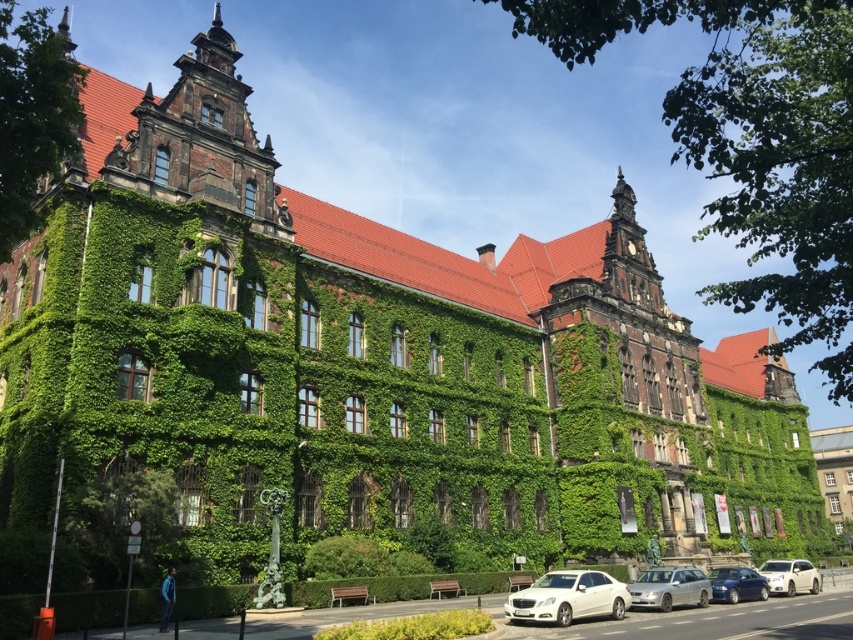
Question: Is silver metallic car at lower center above white matte car at lower right?

Choices:
 (A) no
 (B) yes

Answer: (B)

Question: Considering the real-world distances, which object is closest to the white glossy sedan at center?

Choices:
 (A) white matte car at lower right
 (B) metallic blue sedan at lower right
 (C) silver metallic car at lower center

Answer: (C)

Question: Can you confirm if silver metallic car at lower center is positioned above metallic blue sedan at lower right?

Choices:
 (A) yes
 (B) no

Answer: (B)

Question: Which of the following is the farthest from the observer?

Choices:
 (A) (664, 586)
 (B) (561, 600)
 (C) (790, 570)

Answer: (C)

Question: In this image, where is metallic blue sedan at lower right located relative to white matte car at lower right?

Choices:
 (A) left
 (B) right

Answer: (A)

Question: Based on their relative distances, which object is nearer to the metallic blue sedan at lower right?

Choices:
 (A) silver metallic car at lower center
 (B) white glossy sedan at center
 (C) white matte car at lower right

Answer: (A)